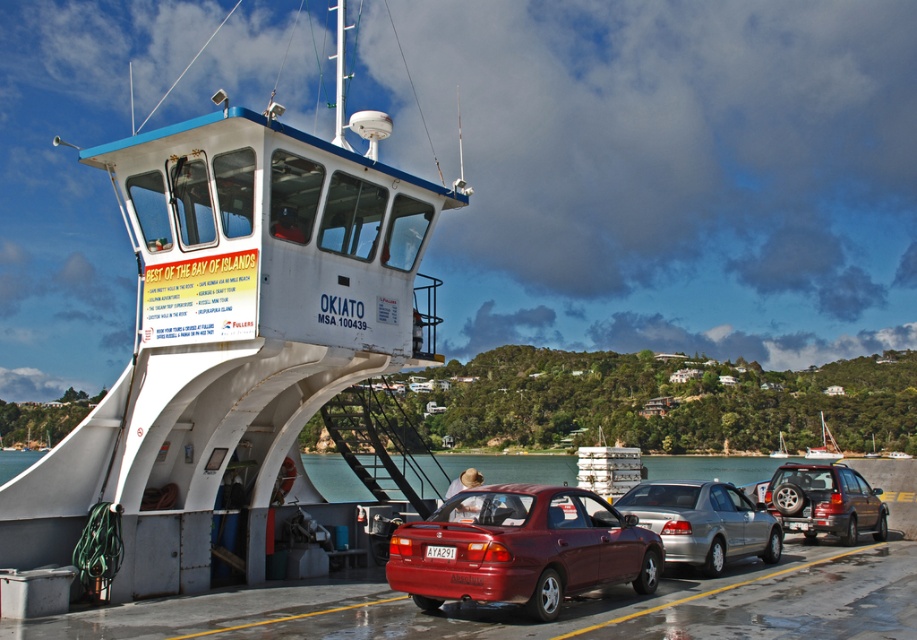
Question: Among these objects, which one is farthest from the camera?

Choices:
 (A) silver metallic sedan at center
 (B) matte red sedan at center
 (C) wooden sailboat at center

Answer: (C)

Question: Does metallic brown suv at center right have a greater width compared to white glossy sailboat at center?

Choices:
 (A) no
 (B) yes

Answer: (B)

Question: Based on their relative distances, which object is farther from the silver metallic sedan at center?

Choices:
 (A) white glossy sailboat at center
 (B) matte red sedan at center

Answer: (A)

Question: Is white matte ferry at center to the right of white glossy sailboat at center from the viewer's perspective?

Choices:
 (A) yes
 (B) no

Answer: (B)

Question: Which of the following is the closest to the observer?

Choices:
 (A) (782, 440)
 (B) (158, 464)
 (C) (714, 541)

Answer: (B)

Question: Considering the relative positions of matte red sedan at center and silver metallic sedan at center in the image provided, where is matte red sedan at center located with respect to silver metallic sedan at center?

Choices:
 (A) above
 (B) below

Answer: (A)